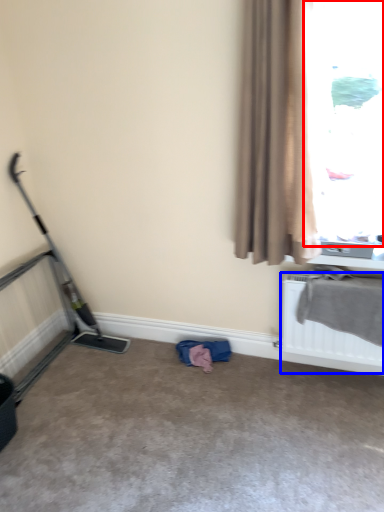
Question: Which point is further to the camera, window (highlighted by a red box) or radiator (highlighted by a blue box)?

Choices:
 (A) window
 (B) radiator

Answer: (B)